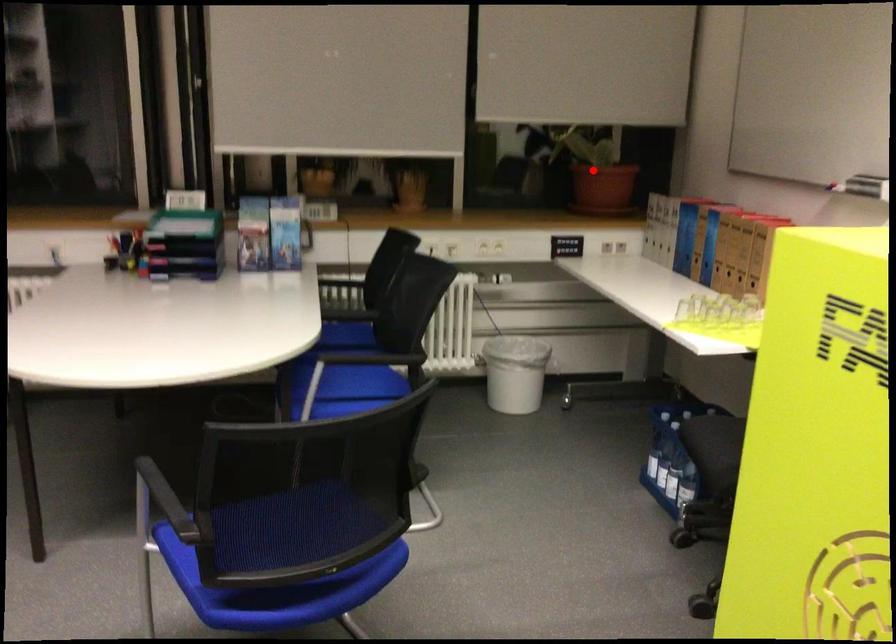
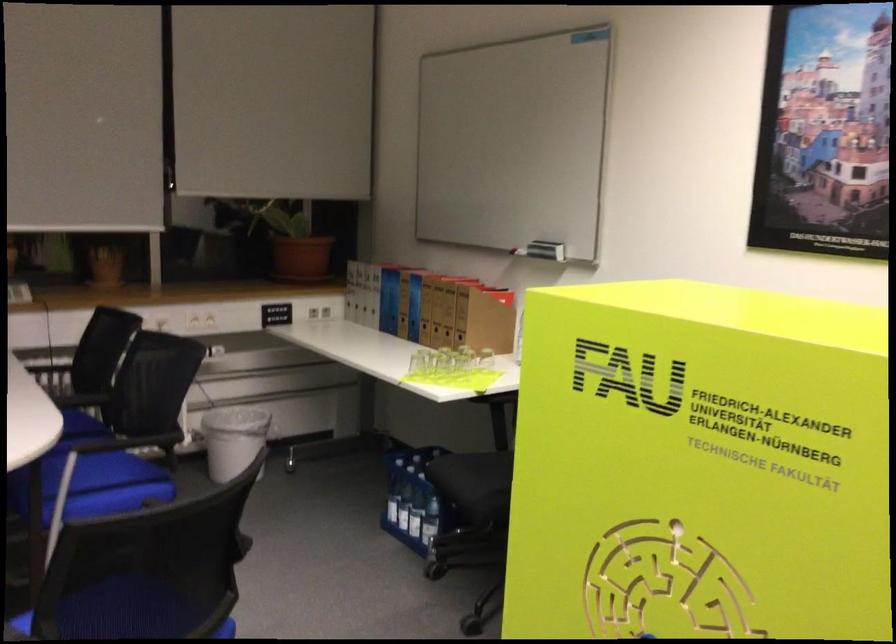
Find the pixel in the second image that matches the highlighted location in the first image.

(294, 243)